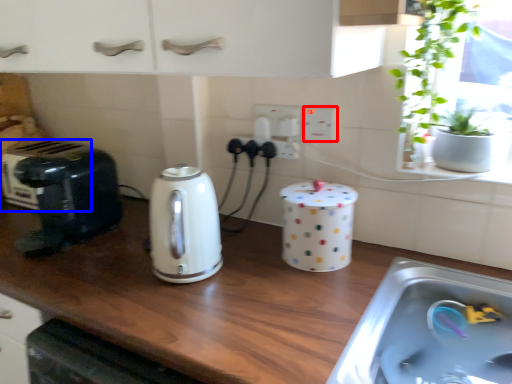
Question: Which object appears farthest to the camera in this image, electric outlet (highlighted by a red box) or appliance (highlighted by a blue box)?

Choices:
 (A) electric outlet
 (B) appliance

Answer: (B)